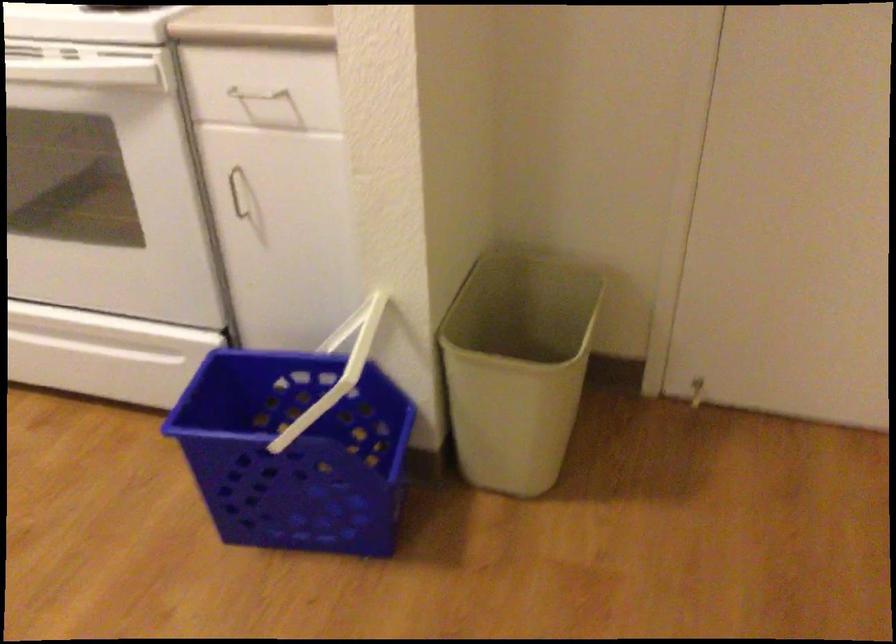
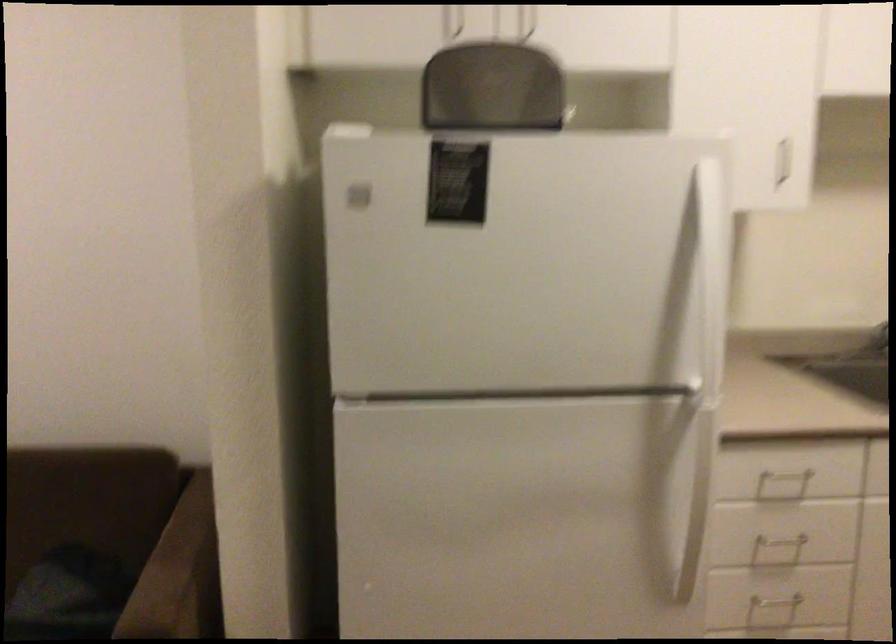
Question: The images are taken continuously from a first-person perspective. In which direction is your viewpoint rotating?

Choices:
 (A) Left
 (B) Right
 (C) Up
 (D) Down

Answer: (A)